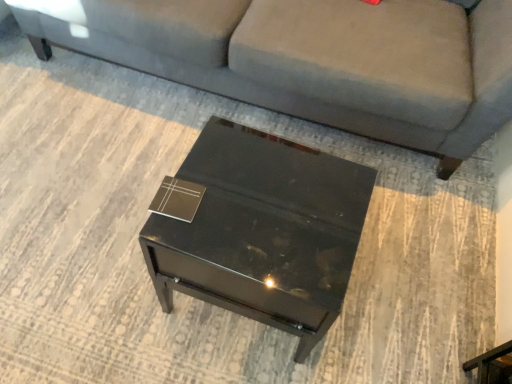
The width and height of the screenshot is (512, 384). In order to click on vacant space behind matte black book at center in this screenshot , I will do `click(211, 153)`.